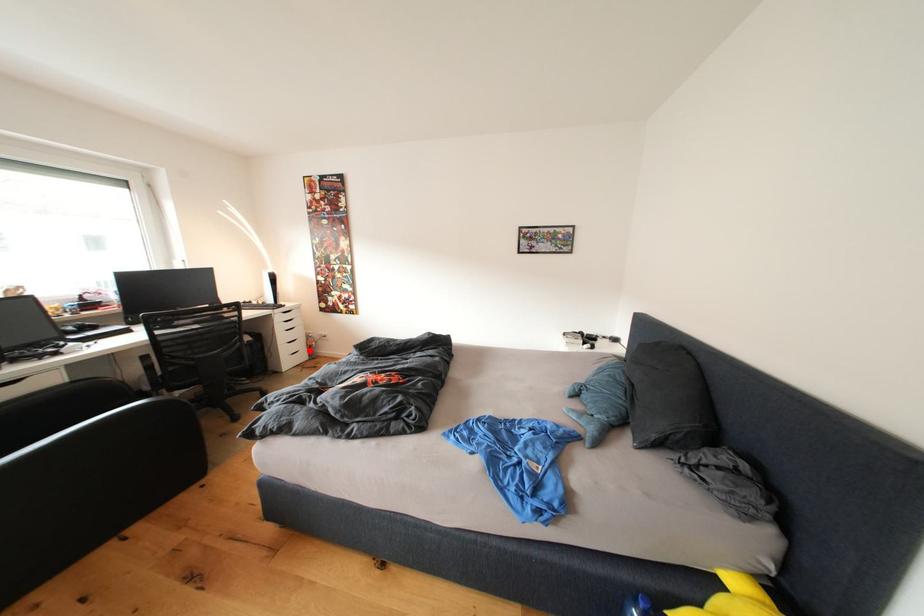
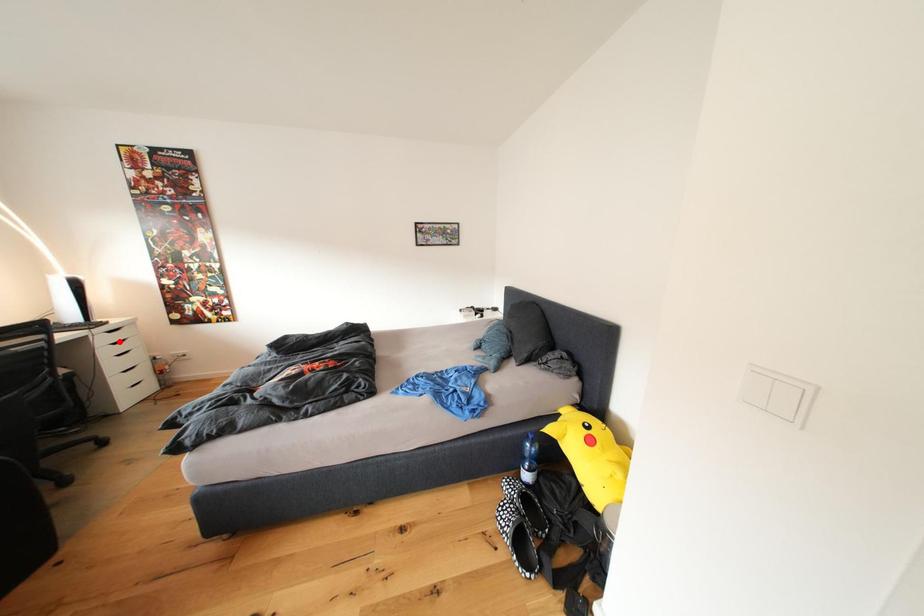
I am providing you with two images of the same scene from different viewpoints. A red point is marked on the first image and another point is marked on the second image. Is the marked point in image1 the same physical position as the marked point in image2?

No